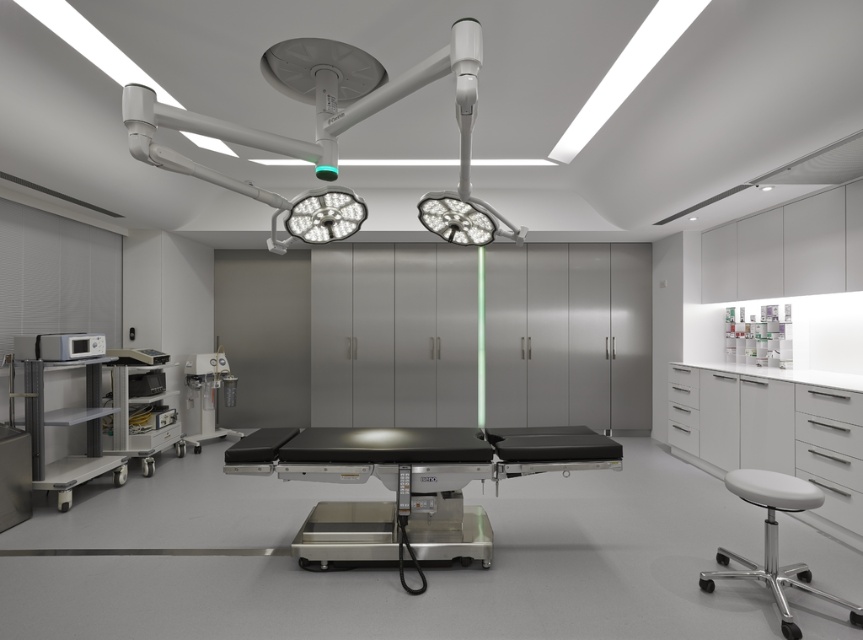
Question: Which of the following is the closest to the observer?

Choices:
 (A) white plastic cart at left
 (B) black matte surgical table at center

Answer: (B)

Question: Can you confirm if metallic gray cart at left is smaller than matte silver microwave at left?

Choices:
 (A) no
 (B) yes

Answer: (A)

Question: Estimate the real-world distances between objects in this image. Which object is farther from the metallic gray cart at left?

Choices:
 (A) white plastic cart at left
 (B) white matte stool at lower right
 (C) matte silver microwave at left

Answer: (B)

Question: From the image, what is the correct spatial relationship of black matte surgical table at center in relation to white matte surgical light at upper center?

Choices:
 (A) right
 (B) left

Answer: (A)

Question: Which point is closer to the camera?

Choices:
 (A) white matte surgical light at upper center
 (B) white matte stool at lower right

Answer: (A)

Question: Is metallic gray cart at left bigger than matte silver oxygen tank at center-left?

Choices:
 (A) no
 (B) yes

Answer: (B)